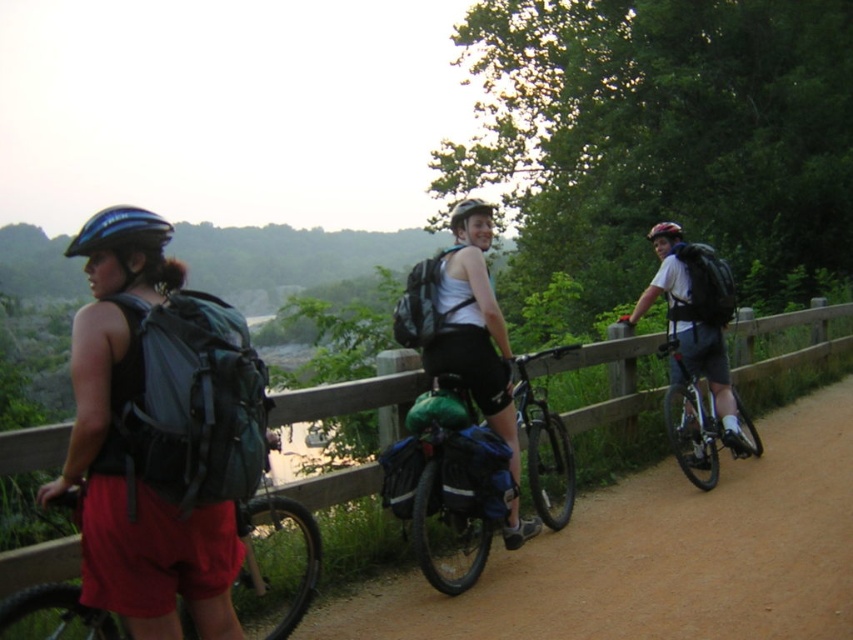
Between wooden fence at center and matte black bicycle at left, which one is positioned higher?

wooden fence at center is above.

From the picture: Does wooden fence at center appear on the left side of matte black bicycle at left?

No, wooden fence at center is not to the left of matte black bicycle at left.

Does point (50, 579) come in front of point (27, 609)?

That is False.

The height and width of the screenshot is (640, 853). Identify the location of wooden fence at center. (610, 380).

Is matte black bicycle at left thinner than matte black backpack at right?

Yes.

Looking at this image, can you confirm if matte black bicycle at left is wider than matte black backpack at right?

In fact, matte black bicycle at left might be narrower than matte black backpack at right.

At what (x,y) coordinates should I click in order to perform the action: click on matte black bicycle at left. Please return your answer as a coordinate pair (x, y). The width and height of the screenshot is (853, 640). Looking at the image, I should click on (276, 564).

Measure the distance between matte black backpack at right and camera.

They are 6.63 meters apart.

Who is more forward, (718, 413) or (525, 381)?

Point (525, 381) is in front.

Where is `matte black backpack at right`? matte black backpack at right is located at coordinates (697, 321).